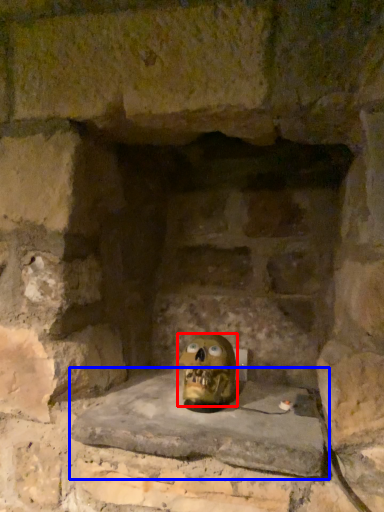
Question: Which object is closer to the camera taking this photo, skull (highlighted by a red box) or window sill (highlighted by a blue box)?

Choices:
 (A) skull
 (B) window sill

Answer: (B)